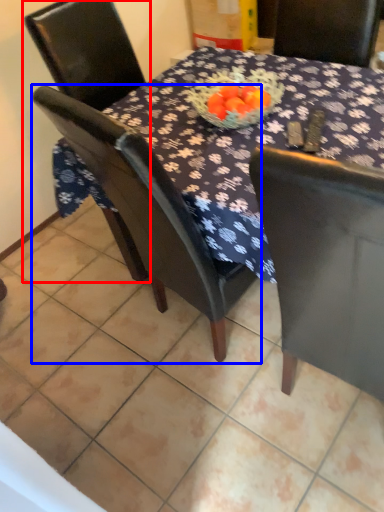
Question: Which of the following is the closest to the observer, chair (highlighted by a red box) or chair (highlighted by a blue box)?

Choices:
 (A) chair
 (B) chair

Answer: (B)